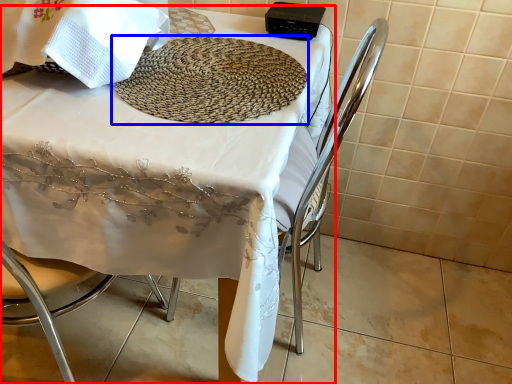
Question: Which object is further to the camera taking this photo, table (highlighted by a red box) or mat (highlighted by a blue box)?

Choices:
 (A) table
 (B) mat

Answer: (B)